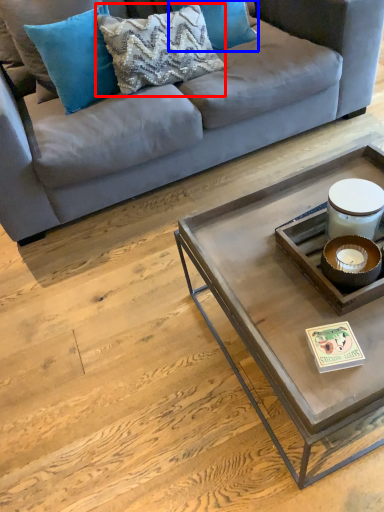
Question: Which object is closer to the camera taking this photo, pillow (highlighted by a red box) or pillow (highlighted by a blue box)?

Choices:
 (A) pillow
 (B) pillow

Answer: (A)